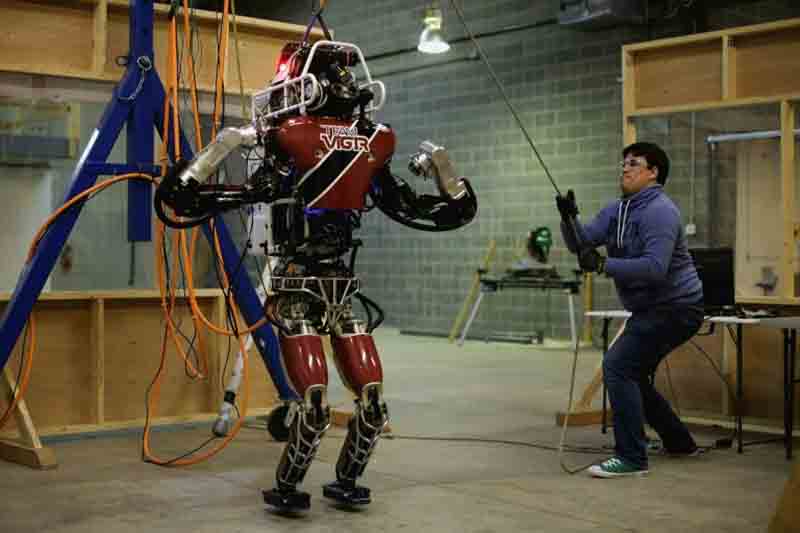
Identify the location of wooden frames. The image size is (800, 533). (121, 374), (46, 27), (654, 64), (766, 61), (788, 230), (750, 379), (778, 512), (582, 413), (66, 386).